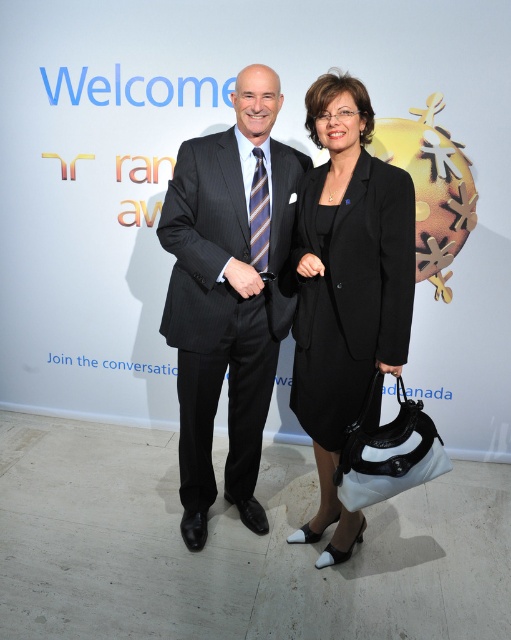
Question: Which object is farther from the camera taking this photo?

Choices:
 (A) black leather dress at center
 (B) striped silk tie at center

Answer: (B)

Question: Does matte black suit at center appear on the right side of black leather dress at center?

Choices:
 (A) yes
 (B) no

Answer: (B)

Question: Is matte black suit at center to the left of black leather dress at center from the viewer's perspective?

Choices:
 (A) yes
 (B) no

Answer: (A)

Question: Considering the real-world distances, which object is farthest from the striped silk tie at center?

Choices:
 (A) black leather dress at center
 (B) matte black suit at center

Answer: (A)

Question: Does black leather dress at center come in front of striped silk tie at center?

Choices:
 (A) no
 (B) yes

Answer: (B)

Question: Which point is closer to the camera taking this photo?

Choices:
 (A) click(x=226, y=301)
 (B) click(x=264, y=237)

Answer: (B)